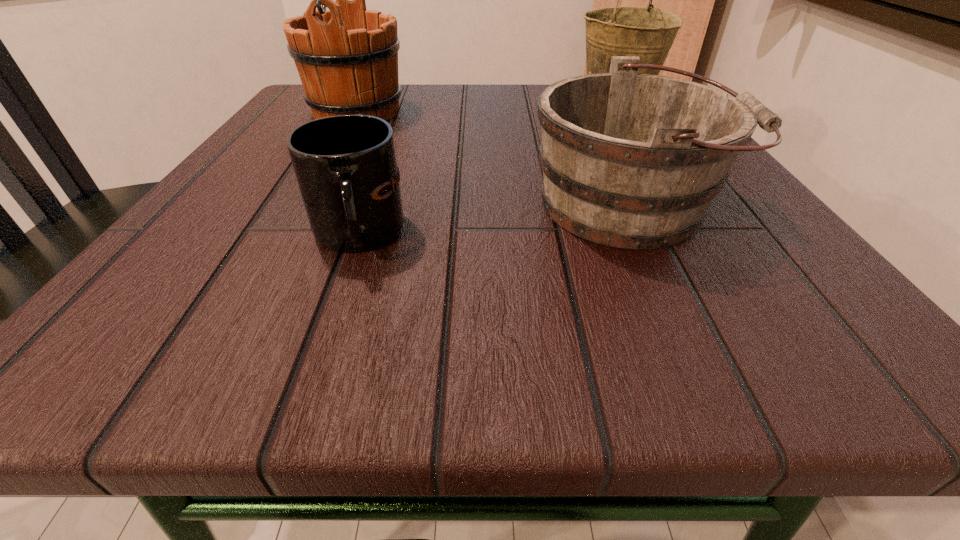
Identify the location of the leftmost wine bucket. (347, 57).

Where is `the tallest wine bucket`? The width and height of the screenshot is (960, 540). the tallest wine bucket is located at coordinates (347, 57).

This screenshot has height=540, width=960. Identify the location of the second tallest object. (646, 32).

The width and height of the screenshot is (960, 540). What are the coordinates of `the shortest wine bucket` in the screenshot? It's located at [630, 160].

Where is `the second shortest object`? the second shortest object is located at coordinates (630, 160).

At what (x,y) coordinates should I click in order to perform the action: click on the shortest object. Please return your answer as a coordinate pair (x, y). This screenshot has width=960, height=540. Looking at the image, I should click on (345, 165).

This screenshot has width=960, height=540. Identify the location of vacant space located on the right of the tallest wine bucket. (495, 113).

Identify the location of free region located on the front of the second tallest object. The width and height of the screenshot is (960, 540). (643, 140).

Where is `free spot located on the back of the nearest wine bucket`? Image resolution: width=960 pixels, height=540 pixels. free spot located on the back of the nearest wine bucket is located at coordinates (591, 128).

This screenshot has width=960, height=540. Identify the location of vacant space situated with the handle on the side of the mug. (322, 338).